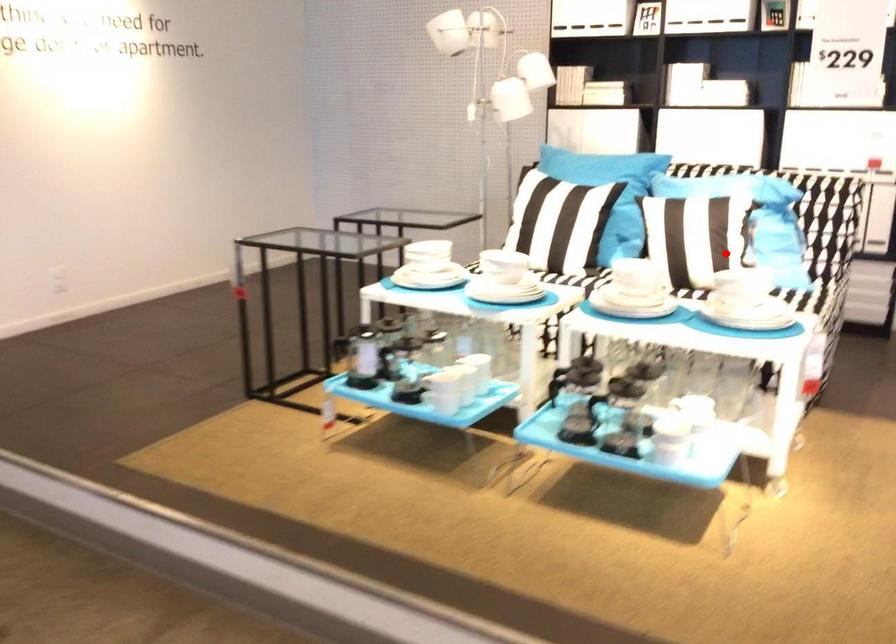
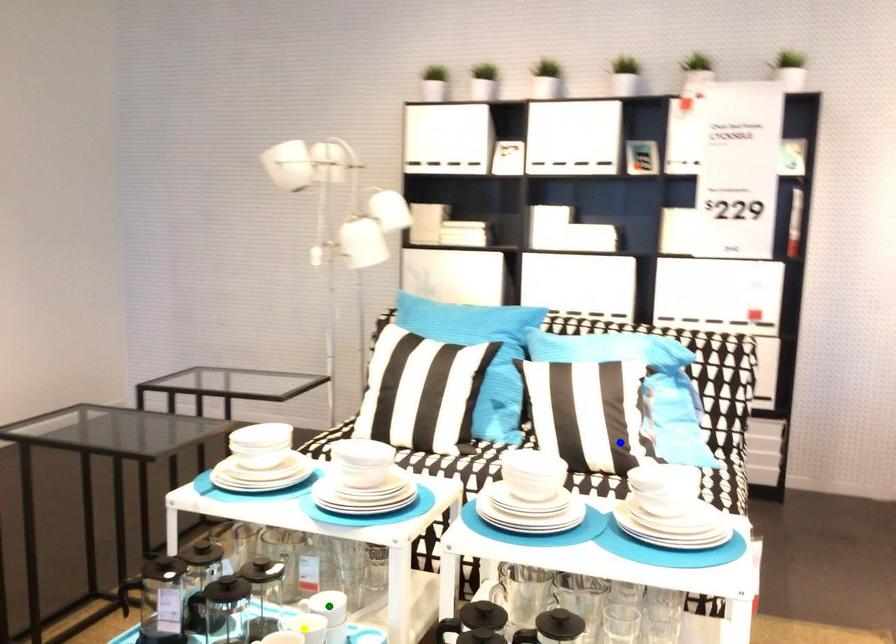
Question: I am providing you with two images of the same scene from different viewpoints. A red point is marked on the first image. You are given multiple points on the second image. Which spot in image 2 lines up with the point in image 1?

Choices:
 (A) yellow point
 (B) blue point
 (C) green point

Answer: (B)